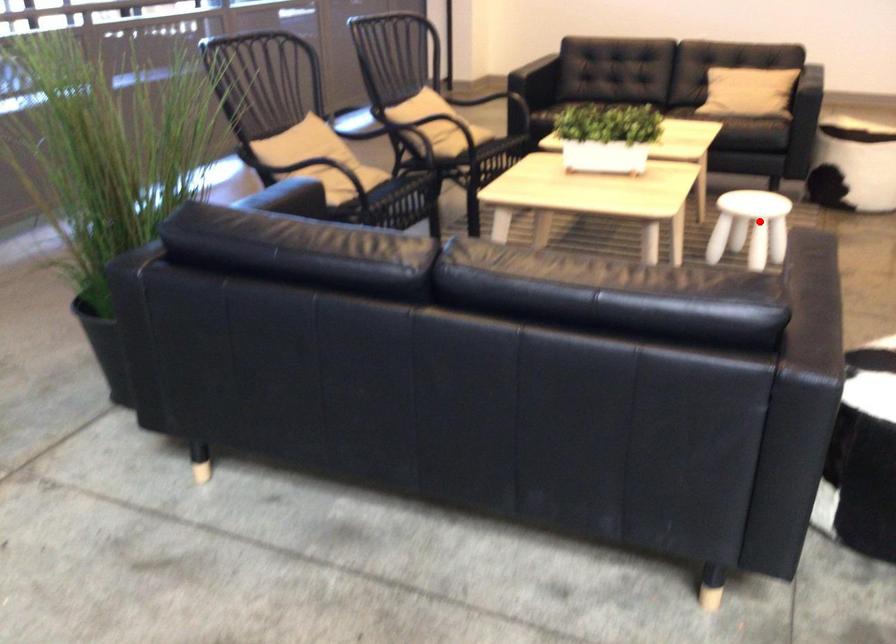
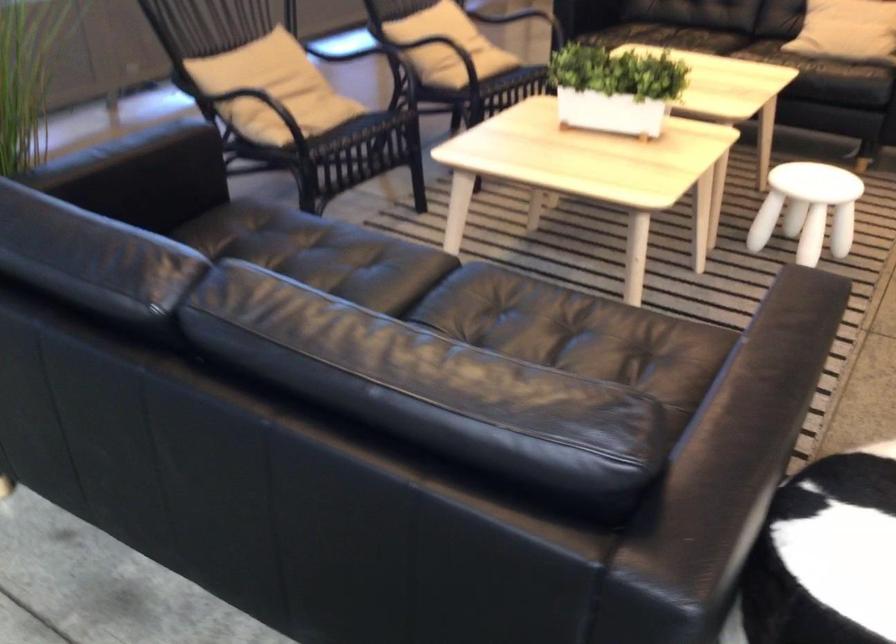
Find the pixel in the second image that matches the highlighted location in the first image.

(807, 209)